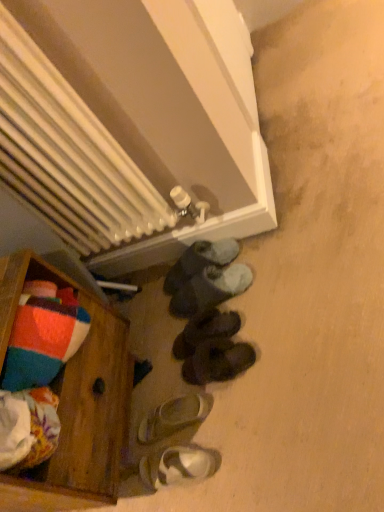
Question: Is white metallic radiator at upper center directly adjacent to white matte sandals at lower center, arranged as the 1th footwear when ordered from the bottom?

Choices:
 (A) no
 (B) yes

Answer: (A)

Question: Can you confirm if white metallic radiator at upper center is positioned to the right of white matte sandals at lower center, arranged as the 1th footwear when ordered from the bottom?

Choices:
 (A) no
 (B) yes

Answer: (A)

Question: Is white metallic radiator at upper center aimed at white matte sandals at lower center, placed as the sixth footwear when sorted from top to bottom?

Choices:
 (A) yes
 (B) no

Answer: (A)

Question: From the image's perspective, does white metallic radiator at upper center appear lower than white matte sandals at lower center, placed as the sixth footwear when sorted from top to bottom?

Choices:
 (A) no
 (B) yes

Answer: (A)

Question: From the image's perspective, is white metallic radiator at upper center on top of white matte sandals at lower center, placed as the sixth footwear when sorted from top to bottom?

Choices:
 (A) no
 (B) yes

Answer: (B)

Question: Considering their positions, is white metallic radiator at upper center located in front of or behind blue fuzzy slippers at center, the sixth footwear positioned from the bottom?

Choices:
 (A) behind
 (B) front

Answer: (B)

Question: Is white metallic radiator at upper center wider or thinner than blue fuzzy slippers at center, the sixth footwear positioned from the bottom?

Choices:
 (A) wide
 (B) thin

Answer: (B)

Question: Based on their positions, is white metallic radiator at upper center located to the left or right of blue fuzzy slippers at center, the sixth footwear positioned from the bottom?

Choices:
 (A) left
 (B) right

Answer: (A)

Question: Based on their sizes in the image, would you say white metallic radiator at upper center is bigger or smaller than blue fuzzy slippers at center, the first footwear from the top?

Choices:
 (A) small
 (B) big

Answer: (B)

Question: Is point (170, 290) closer or farther from the camera than point (210, 335)?

Choices:
 (A) closer
 (B) farther

Answer: (B)

Question: From a real-world perspective, relative to black suede slippers at center, which appears as the 4th footwear when ordered from the bottom, is blue fuzzy slippers at center, the first footwear from the top, vertically above or below?

Choices:
 (A) above
 (B) below

Answer: (A)

Question: In terms of height, does blue fuzzy slippers at center, the first footwear from the top, look taller or shorter compared to black suede slippers at center, which appears as the 4th footwear when ordered from the bottom?

Choices:
 (A) short
 (B) tall

Answer: (A)

Question: Is blue fuzzy slippers at center, the first footwear from the top, situated inside black suede slippers at center, which is counted as the third footwear, starting from the top, or outside?

Choices:
 (A) outside
 (B) inside

Answer: (A)

Question: Is point (46, 477) closer or farther from the camera than point (187, 356)?

Choices:
 (A) closer
 (B) farther

Answer: (A)

Question: Relative to black suede slippers at center, which appears as the 4th footwear when ordered from the bottom, is wooden chest at lower left in front or behind?

Choices:
 (A) front
 (B) behind

Answer: (A)